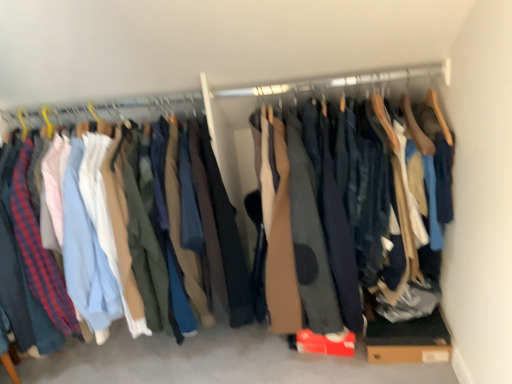
Question: Does brown cardboard box at lower right have a lesser width compared to wooden hanger at upper center?

Choices:
 (A) no
 (B) yes

Answer: (A)

Question: Considering the relative sizes of brown cardboard box at lower right and wooden hanger at upper center in the image provided, is brown cardboard box at lower right shorter than wooden hanger at upper center?

Choices:
 (A) yes
 (B) no

Answer: (B)

Question: Is brown cardboard box at lower right further to the viewer compared to wooden hanger at upper center?

Choices:
 (A) no
 (B) yes

Answer: (B)

Question: Considering the relative sizes of brown cardboard box at lower right and wooden hanger at upper center in the image provided, is brown cardboard box at lower right taller than wooden hanger at upper center?

Choices:
 (A) no
 (B) yes

Answer: (B)

Question: Does brown cardboard box at lower right appear on the right side of wooden hanger at upper center?

Choices:
 (A) yes
 (B) no

Answer: (A)

Question: Considering the relative positions of dark gray fabric pants at center and dark blue cotton pants at left in the image provided, is dark gray fabric pants at center to the left or to the right of dark blue cotton pants at left?

Choices:
 (A) right
 (B) left

Answer: (A)

Question: Is point (276, 256) positioned closer to the camera than point (252, 129)?

Choices:
 (A) closer
 (B) farther

Answer: (A)

Question: Considering the positions of dark gray fabric pants at center and dark blue cotton pants at left in the image, is dark gray fabric pants at center taller or shorter than dark blue cotton pants at left?

Choices:
 (A) tall
 (B) short

Answer: (B)

Question: In the image, is dark gray fabric pants at center positioned in front of or behind dark blue cotton pants at left?

Choices:
 (A) front
 (B) behind

Answer: (A)

Question: Is point (407, 337) closer or farther from the camera than point (315, 175)?

Choices:
 (A) closer
 (B) farther

Answer: (B)

Question: From the image's perspective, relative to dark gray fabric pants at center, is brown cardboard box at lower right above or below?

Choices:
 (A) below
 (B) above

Answer: (A)

Question: From a real-world perspective, relative to dark gray fabric pants at center, is brown cardboard box at lower right vertically above or below?

Choices:
 (A) above
 (B) below

Answer: (B)

Question: Considering the positions of brown cardboard box at lower right and dark gray fabric pants at center in the image, is brown cardboard box at lower right taller or shorter than dark gray fabric pants at center?

Choices:
 (A) short
 (B) tall

Answer: (A)

Question: From a real-world perspective, is brown cardboard box at lower right positioned above or below dark blue cotton pants at left?

Choices:
 (A) below
 (B) above

Answer: (A)

Question: Looking at the image, does brown cardboard box at lower right seem bigger or smaller compared to dark blue cotton pants at left?

Choices:
 (A) big
 (B) small

Answer: (B)